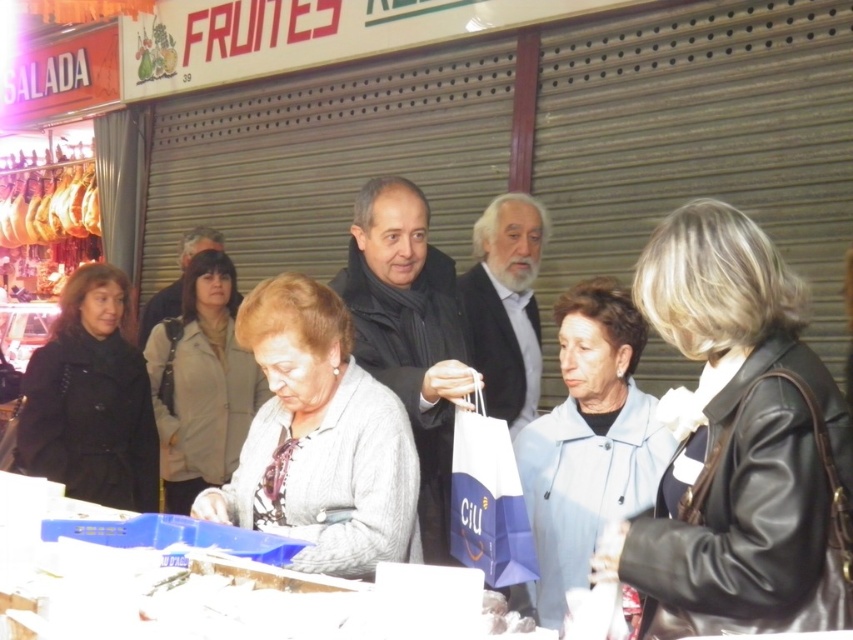
Question: Is dark gray jacket at center in front of white beard at center?

Choices:
 (A) no
 (B) yes

Answer: (B)

Question: Is white beard at center to the right of light brown leather jacket at center from the viewer's perspective?

Choices:
 (A) yes
 (B) no

Answer: (A)

Question: Which point is closer to the camera taking this photo?

Choices:
 (A) (531, 324)
 (B) (421, 296)

Answer: (B)

Question: Among these points, which one is nearest to the camera?

Choices:
 (A) (450, 326)
 (B) (491, 513)

Answer: (B)

Question: Does dark gray jacket at center have a lesser width compared to white paper shopping bag at center?

Choices:
 (A) yes
 (B) no

Answer: (B)

Question: Which point is farther from the camera taking this photo?

Choices:
 (A) (444, 372)
 (B) (480, 310)
 (C) (144, 310)
 (D) (527, 577)

Answer: (C)